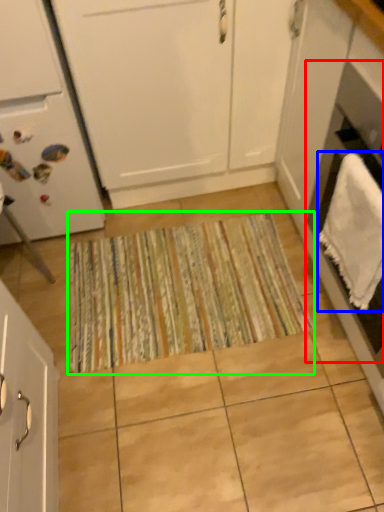
Question: Estimate the real-world distances between objects in this image. Which object is closer to oven (highlighted by a red box), bath towel (highlighted by a blue box) or doormat (highlighted by a green box)?

Choices:
 (A) bath towel
 (B) doormat

Answer: (A)